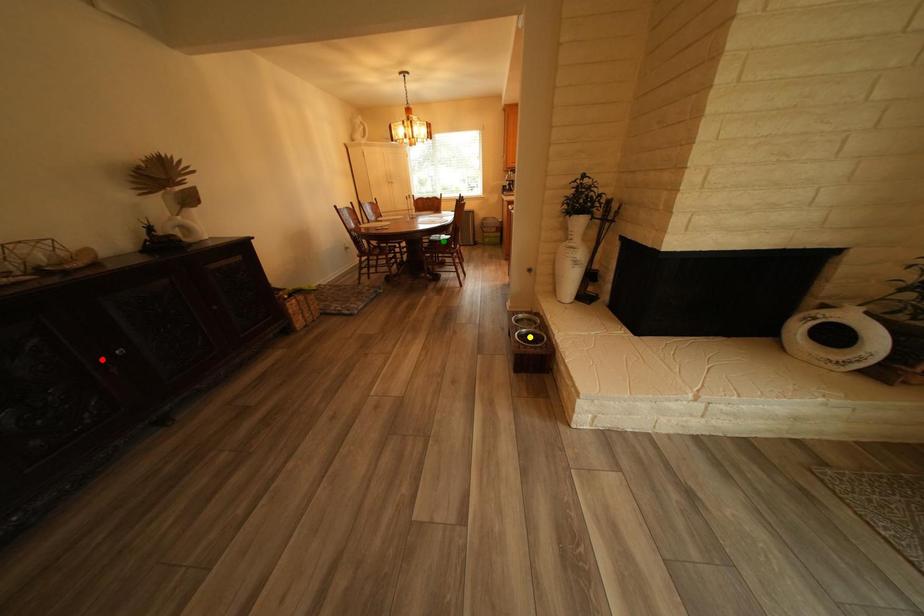
Order these from nearest to farthest:
A) yellow point
B) red point
C) green point

green point, yellow point, red point